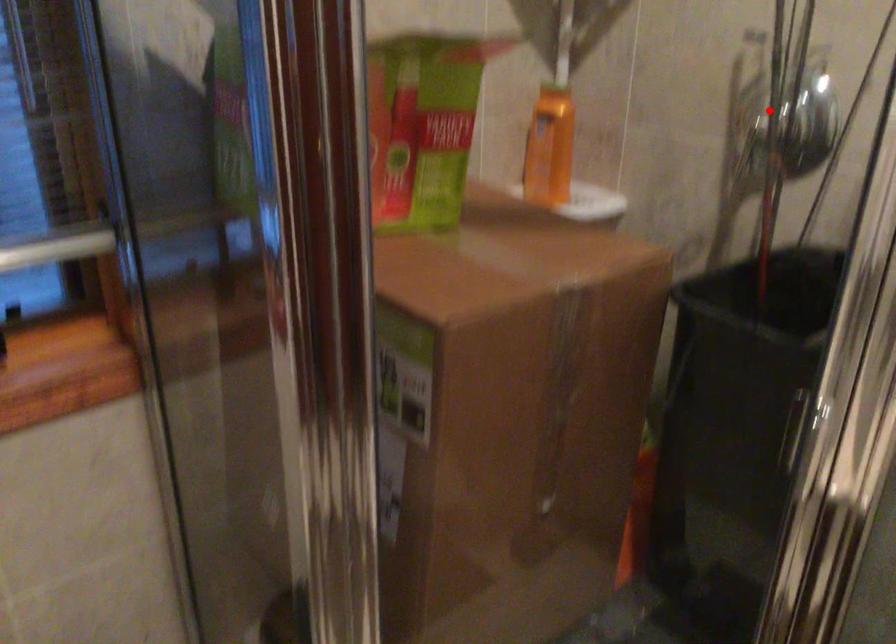
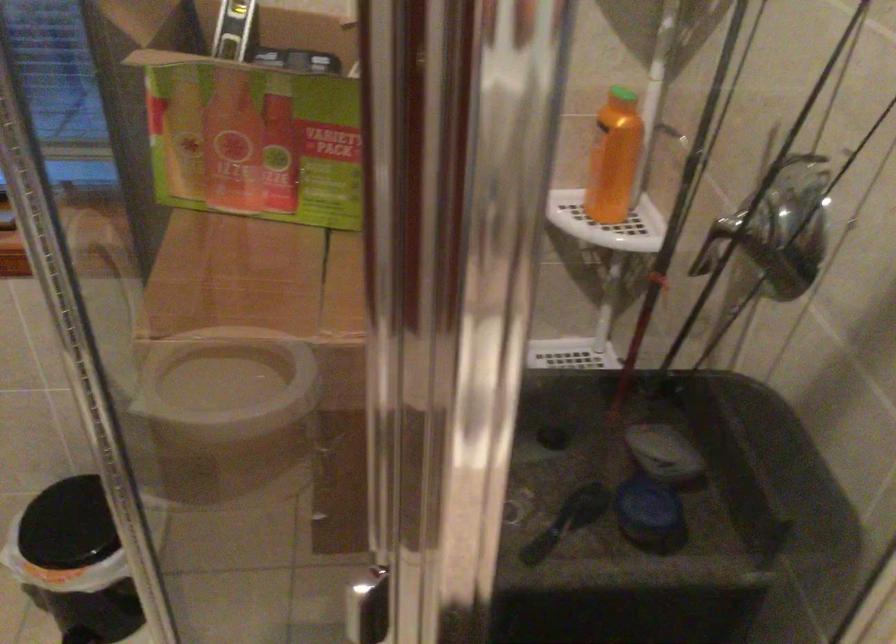
Question: I am providing you with two images of the same scene from different viewpoints. In image1, a red point is highlighted. Considering the same 3D point in image2, which of the following is correct?

Choices:
 (A) It is closer
 (B) It is farther

Answer: (A)